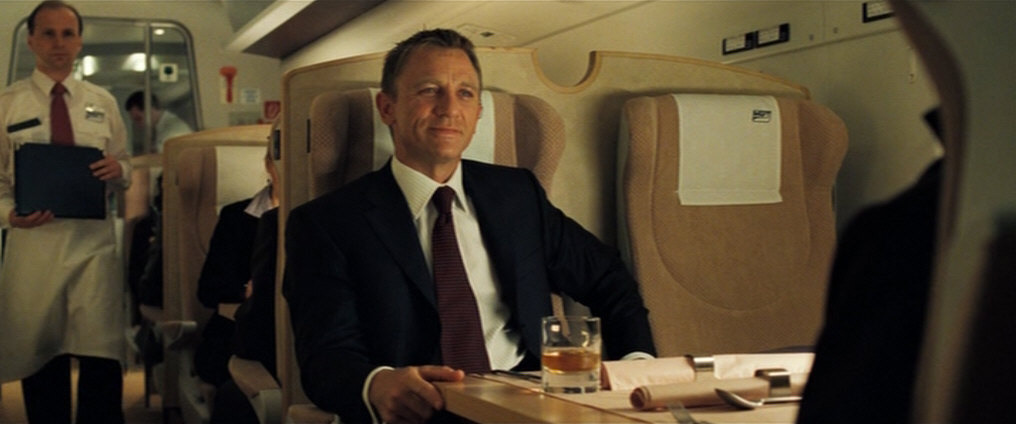
This screenshot has height=424, width=1016. Find the location of `glass`. glass is located at coordinates (569, 330).